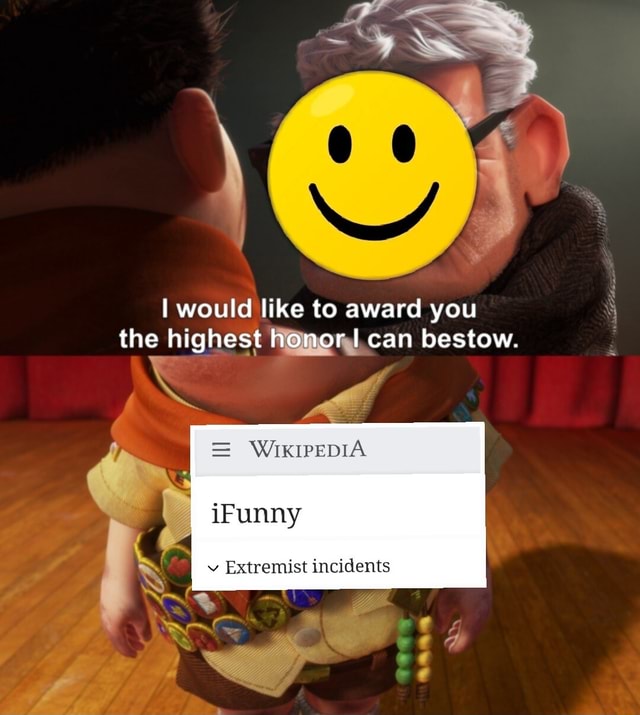
Where is `brown wood floor`? brown wood floor is located at coordinates (107, 689).